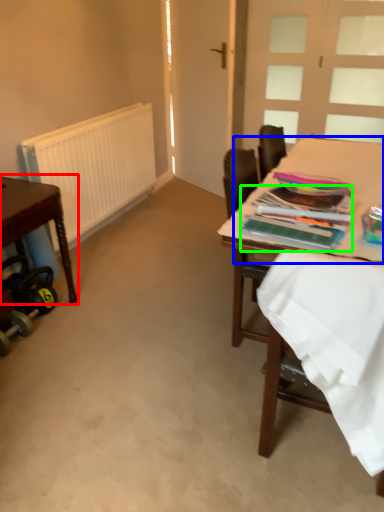
Question: Estimate the real-world distances between objects in this image. Which object is closer to table (highlighted by a red box), table top (highlighted by a blue box) or magazine (highlighted by a green box)?

Choices:
 (A) table top
 (B) magazine

Answer: (B)